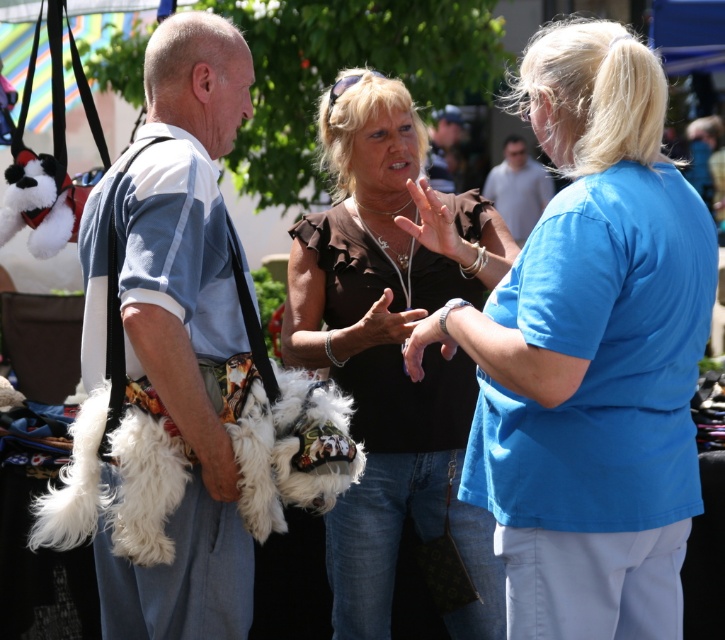
Question: Is blue cotton shirt at upper right bigger than white fur bag at left?

Choices:
 (A) yes
 (B) no

Answer: (A)

Question: Which point appears closest to the camera in this image?

Choices:
 (A) (626, 93)
 (B) (481, 550)

Answer: (A)

Question: Is brown ruffled shirt at center smaller than white fluffy dog at center?

Choices:
 (A) no
 (B) yes

Answer: (A)

Question: Which point is farther to the camera?

Choices:
 (A) white fur bag at left
 (B) matte brown leather wallet at center
 (C) blue cotton shirt at upper right

Answer: (B)

Question: Is white fur bag at left smaller than matte brown leather wallet at center?

Choices:
 (A) yes
 (B) no

Answer: (B)

Question: Which of the following is the farthest from the observer?

Choices:
 (A) blue cotton shirt at upper right
 (B) white fluffy dog at center
 (C) white fur bag at left
 (D) matte brown leather wallet at center

Answer: (D)